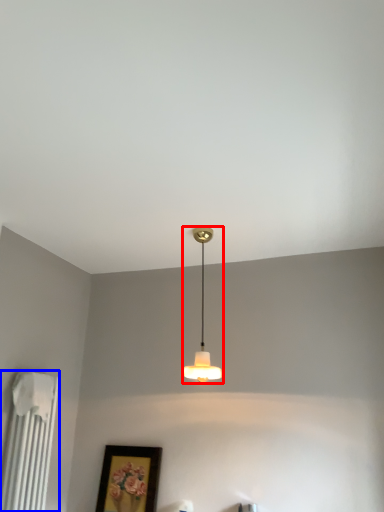
Question: Which object appears closest to the camera in this image, lamp (highlighted by a red box) or radiator (highlighted by a blue box)?

Choices:
 (A) lamp
 (B) radiator

Answer: (B)